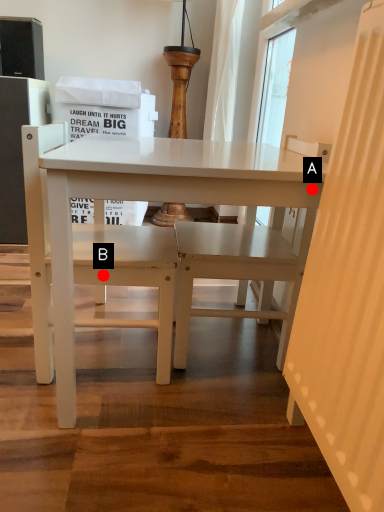
Question: Two points are circled on the image, labeled by A and B beside each circle. Which point appears closest to the camera in this image?

Choices:
 (A) A is closer
 (B) B is closer

Answer: (A)